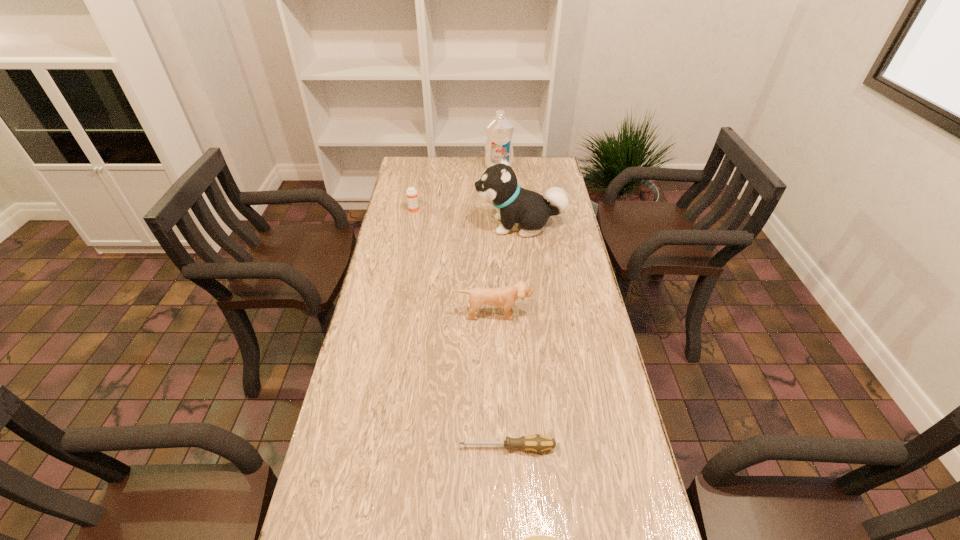
Where is `vacant space located on the right of the detergent`? vacant space located on the right of the detergent is located at coordinates (549, 166).

Locate an element on the screen. The width and height of the screenshot is (960, 540). vacant region located on the left side of the third nearest object is located at coordinates point(495,442).

Locate an element on the screen. vacant space located on the front of the medicine is located at coordinates (404, 263).

Locate an element on the screen. Image resolution: width=960 pixels, height=540 pixels. free space located 0.260m at the tip of the shortest object is located at coordinates click(351, 447).

Where is `free spot located 0.140m at the tip of the shortest object`? free spot located 0.140m at the tip of the shortest object is located at coordinates (401, 447).

At what (x,y) coordinates should I click in order to perform the action: click on vacant area situated at the tip of the shortest object. Please return your answer as a coordinate pair (x, y). The width and height of the screenshot is (960, 540). Looking at the image, I should click on (389, 447).

Identify the location of object situated at the far edge. (499, 130).

This screenshot has width=960, height=540. Identify the location of object that is at the left edge. (412, 199).

In order to click on object that is at the right edge in this screenshot , I will do `click(498, 185)`.

In the image, there is a desktop. Where is `free region at the far edge`? free region at the far edge is located at coordinates (471, 164).